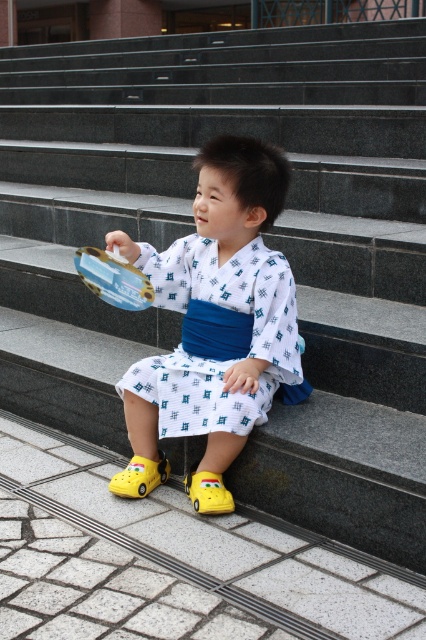
You are a photographer setting up a tripod to take a portrait of the child. The tripod legs must be placed on the yellow rubber shoe at lower center and the yellow rubber shoe at lower left. However, the tripod requires that the two shoes are at the same height. Is this possible?

The yellow rubber shoe at lower center is taller than the yellow rubber shoe at lower left, so the tripod legs cannot be placed on them because they are not at the same height.

You are a parent trying to pack your childs toys and shoes into a small box. The box can only fit items that are under 10 centimeters in height. You see the metallic plastic toy car at center and the yellow rubber shoe at lower left. Which item will not fit in the box?

The metallic plastic toy car at center is much taller than the yellow rubber shoe at lower left, so the metallic plastic toy car at center will not fit in the box since it exceeds the height limit of 10 centimeters.